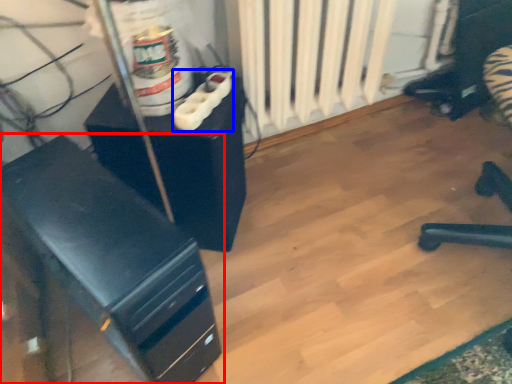
Question: Which object appears closest to the camera in this image, furniture (highlighted by a red box) or plug (highlighted by a blue box)?

Choices:
 (A) furniture
 (B) plug

Answer: (A)